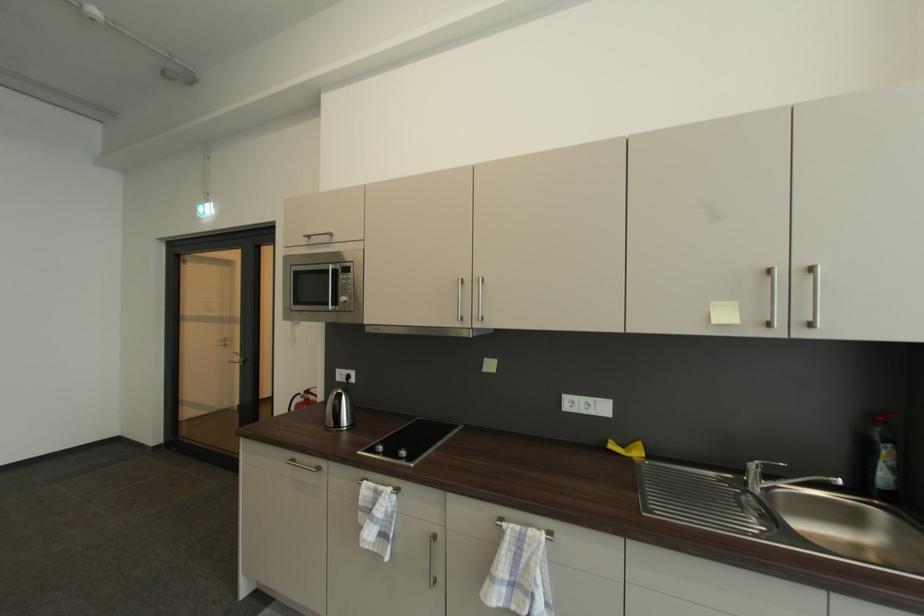
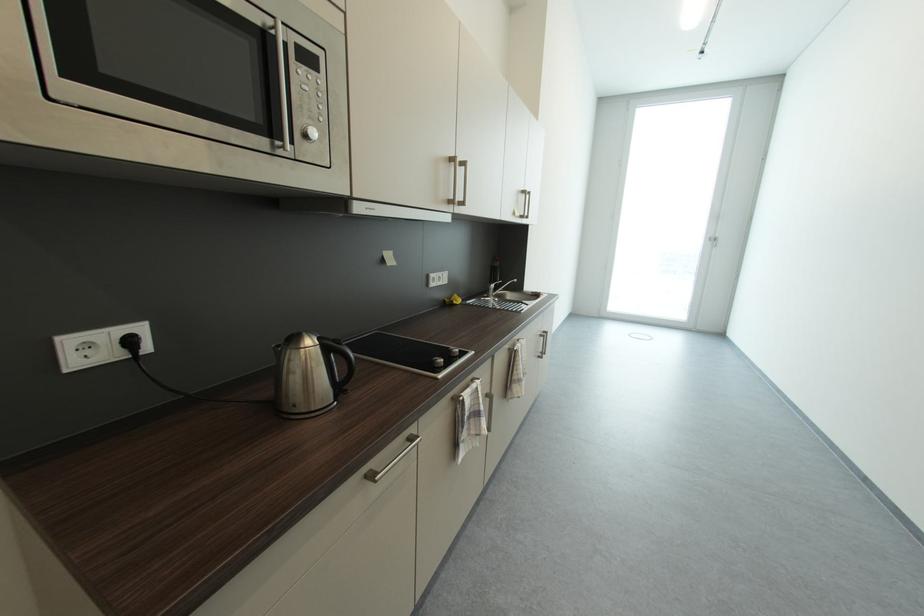
In the second image, find the point that corresponds to (x=355, y=378) in the first image.

(137, 344)